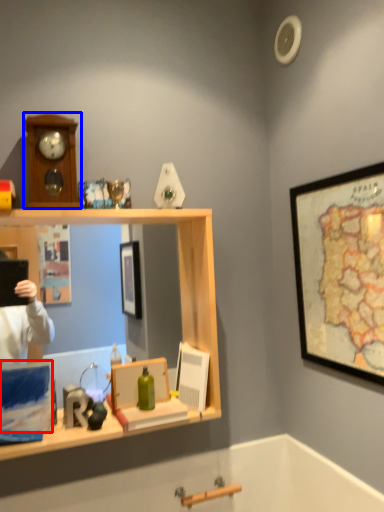
Question: Which of the following is the farthest to the observer, box (highlighted by a red box) or clock (highlighted by a blue box)?

Choices:
 (A) box
 (B) clock

Answer: (B)